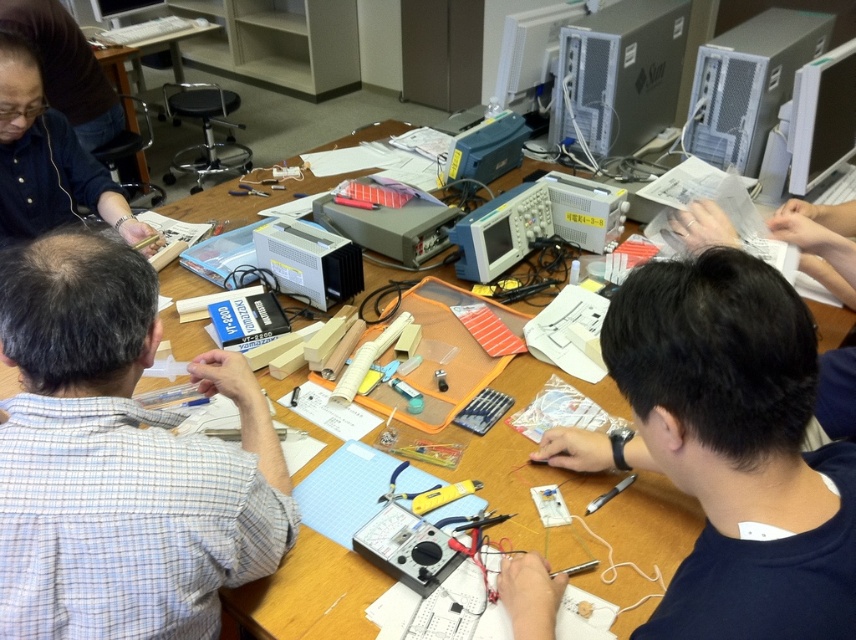
You are a participant in the electronics workshop. You need to place a small electronic component on the wooden table at center. Can you place it on top of the satin silver computer at upper center?

The wooden table at center has a greater height compared to the satin silver computer at upper center. Therefore, you cannot place the small electronic component on top of the satin silver computer at upper center because the table is taller than the computer.

You are standing at the front of the classroom looking at the table. Which of the two points, point (638, 545) or point (774, 8), is closer to you?

Point (774, 8) is closer to you because it is behind point (638, 545), which is in front.

You are organizing a workshop and need to place a large poster on the table. Considering the wooden table at center and the gray metallic computer at upper right, which surface has enough space to accommodate the poster?

The wooden table at center is larger in size than the gray metallic computer at upper right, so the wooden table at center has enough space to accommodate the poster.